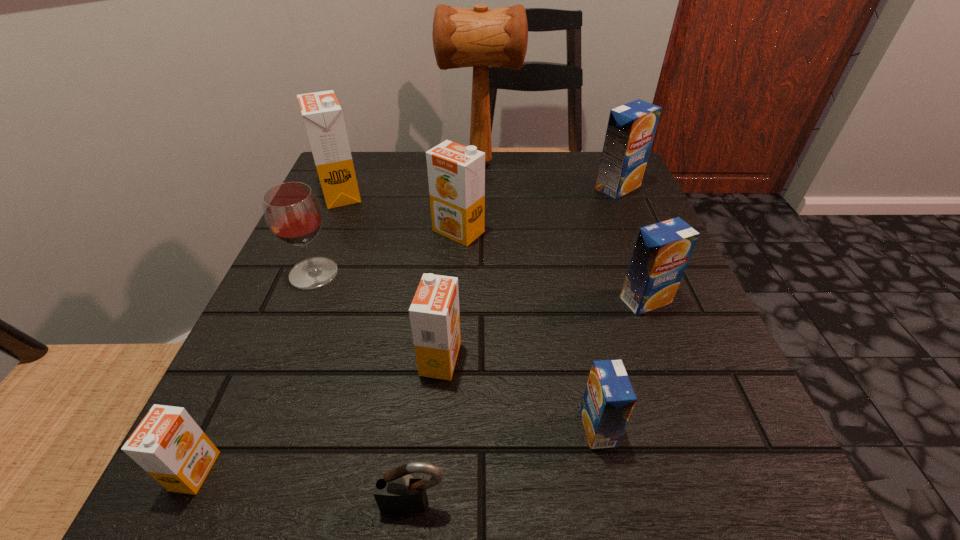
At what (x,y) coordinates should I click in order to perform the action: click on object at the far left corner. Please return your answer as a coordinate pair (x, y). This screenshot has width=960, height=540. Looking at the image, I should click on (322, 114).

The width and height of the screenshot is (960, 540). Identify the location of object present at the near left corner. (168, 444).

You are a GUI agent. You are given a task and a screenshot of the screen. Output one action in this format:
    pyautogui.click(x=<x>, y=<y>)
    Task: Click on the object located in the far right corner section of the desktop
    
    Given the screenshot: What is the action you would take?
    pyautogui.click(x=631, y=127)

Identify the location of vacant space at the far edge of the desktop. Image resolution: width=960 pixels, height=540 pixels. (403, 201).

The image size is (960, 540). In order to click on free point at the near edge in this screenshot , I will do `click(409, 441)`.

Find the location of a particular element. This screenshot has width=960, height=540. vacant space at the left edge of the desktop is located at coordinates [279, 287].

Locate an element on the screen. Image resolution: width=960 pixels, height=540 pixels. free space at the right edge of the desktop is located at coordinates (682, 415).

At what (x,y) coordinates should I click in order to perform the action: click on free space at the far left corner. Please return your answer as a coordinate pair (x, y). This screenshot has height=540, width=960. Looking at the image, I should click on (390, 185).

In the image, there is a desktop. Where is `vacant space at the near left corner`? vacant space at the near left corner is located at coordinates (218, 464).

The width and height of the screenshot is (960, 540). In the image, there is a desktop. In order to click on vacant area at the far right corner in this screenshot , I will do `click(643, 193)`.